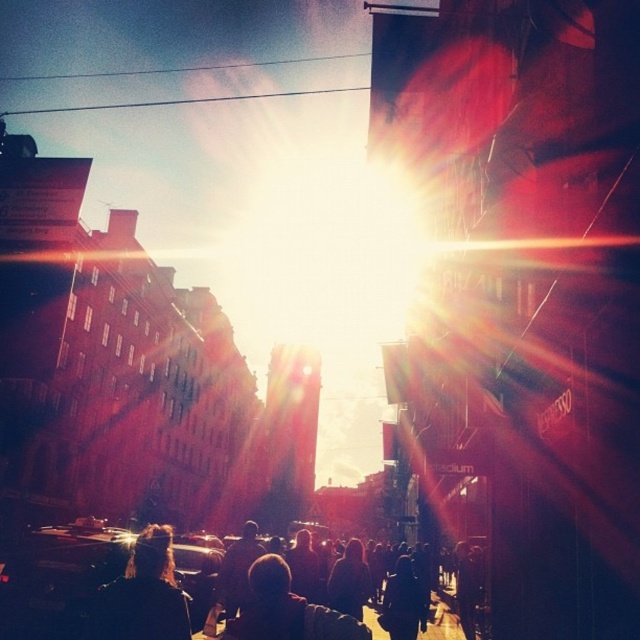
Is dark hair at lower left positioned in front of dark hair at center?

No, it is not.

Is dark hair at lower left wider than dark hair at center?

Indeed, dark hair at lower left has a greater width compared to dark hair at center.

I want to click on dark hair at lower left, so click(141, 595).